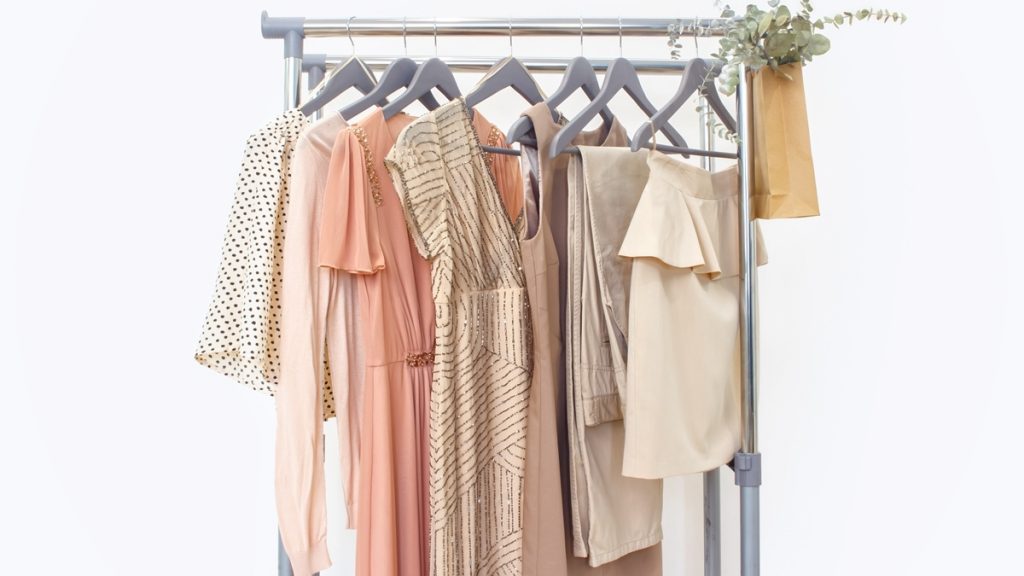
The width and height of the screenshot is (1024, 576). In order to click on clothes hangers in this screenshot , I will do `click(702, 79)`, `click(616, 85)`, `click(587, 73)`, `click(520, 71)`, `click(435, 69)`, `click(390, 75)`, `click(352, 71)`.